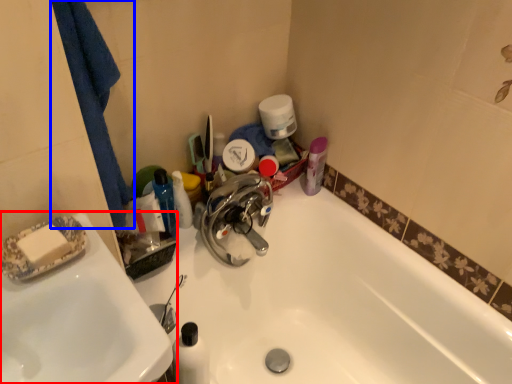
Question: Which object is closer to the camera taking this photo, sink (highlighted by a red box) or bath towel (highlighted by a blue box)?

Choices:
 (A) sink
 (B) bath towel

Answer: (A)